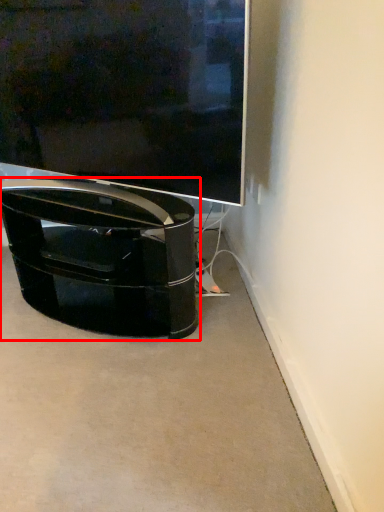
Question: From the image's perspective, where is furniture (annotated by the red box) located in relation to television in the image?

Choices:
 (A) above
 (B) below

Answer: (B)